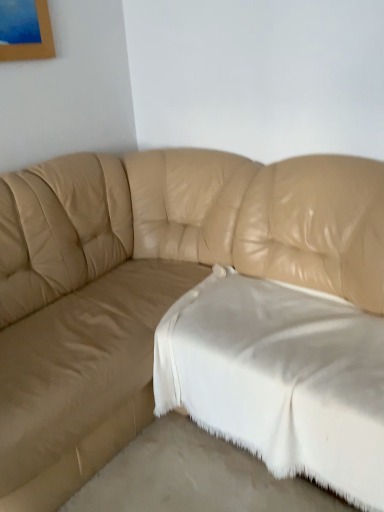
Question: Is white soft fabric at lower right closer to camera compared to tan leather couch at center?

Choices:
 (A) yes
 (B) no

Answer: (B)

Question: Considering the relative sizes of white soft fabric at lower right and tan leather couch at center in the image provided, is white soft fabric at lower right wider than tan leather couch at center?

Choices:
 (A) yes
 (B) no

Answer: (B)

Question: Is white soft fabric at lower right facing away from tan leather couch at center?

Choices:
 (A) no
 (B) yes

Answer: (B)

Question: Is white soft fabric at lower right touching tan leather couch at center?

Choices:
 (A) yes
 (B) no

Answer: (B)

Question: Would you say white soft fabric at lower right contains tan leather couch at center?

Choices:
 (A) no
 (B) yes

Answer: (A)

Question: Considering the positions of point (127, 472) and point (306, 437), is point (127, 472) closer or farther from the camera than point (306, 437)?

Choices:
 (A) farther
 (B) closer

Answer: (A)

Question: From the image's perspective, relative to white soft fabric at lower right, is white fabric at lower center above or below?

Choices:
 (A) below
 (B) above

Answer: (A)

Question: Relative to white soft fabric at lower right, is white fabric at lower center in front or behind?

Choices:
 (A) behind
 (B) front

Answer: (B)

Question: Looking at their shapes, would you say white fabric at lower center is wider or thinner than white soft fabric at lower right?

Choices:
 (A) thin
 (B) wide

Answer: (A)

Question: Is white fabric at lower center bigger or smaller than tan leather couch at center?

Choices:
 (A) big
 (B) small

Answer: (B)

Question: From their relative heights in the image, would you say white fabric at lower center is taller or shorter than tan leather couch at center?

Choices:
 (A) short
 (B) tall

Answer: (A)

Question: In the image, is white fabric at lower center on the left side or the right side of tan leather couch at center?

Choices:
 (A) right
 (B) left

Answer: (A)

Question: Looking at their shapes, would you say white fabric at lower center is wider or thinner than tan leather couch at center?

Choices:
 (A) wide
 (B) thin

Answer: (B)

Question: Choose the correct answer: Is white soft fabric at lower right inside tan leather couch at center or outside it?

Choices:
 (A) outside
 (B) inside

Answer: (B)

Question: Considering the positions of point (213, 298) and point (155, 293), is point (213, 298) closer or farther from the camera than point (155, 293)?

Choices:
 (A) closer
 (B) farther

Answer: (A)